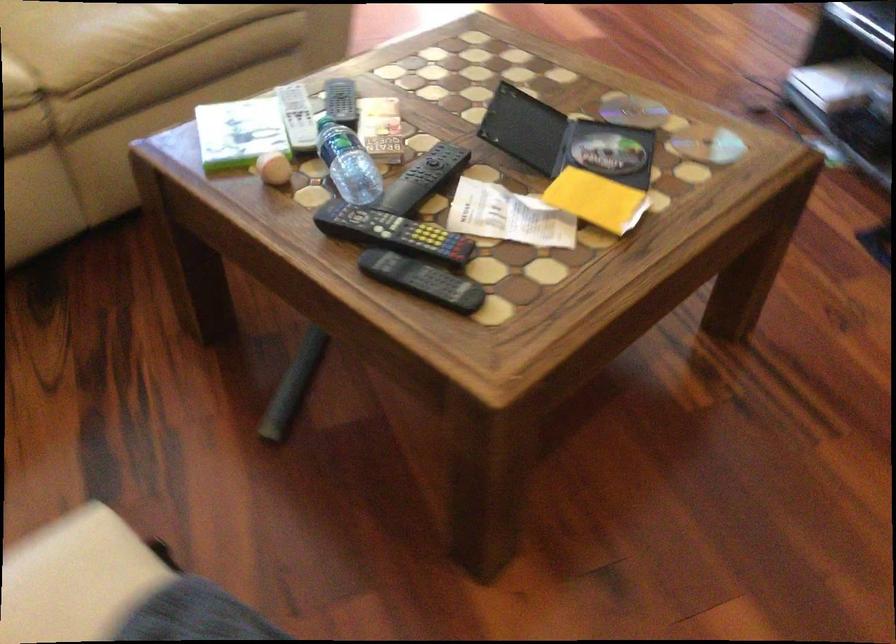
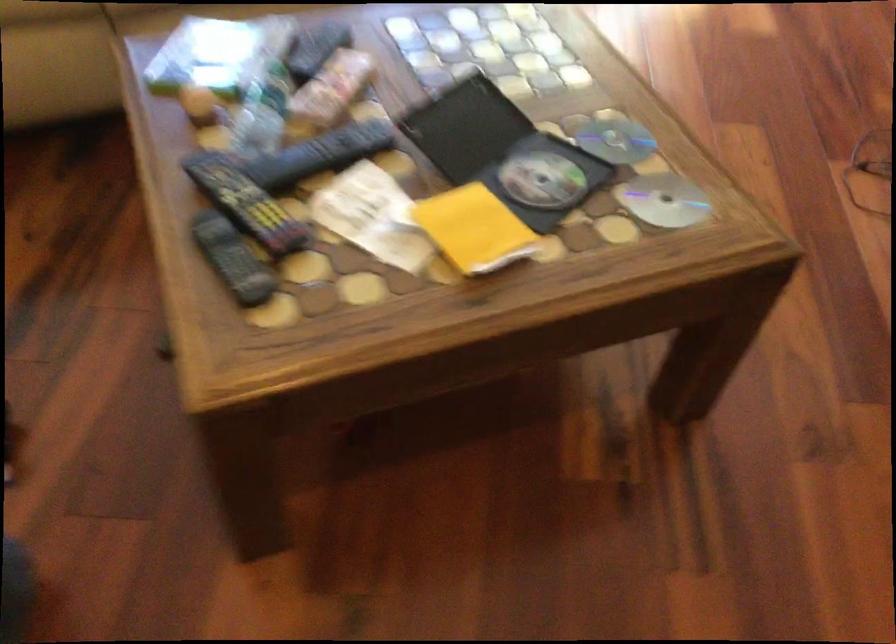
Locate, in the second image, the point that corresponds to the point at 700,142 in the first image.

(664, 200)